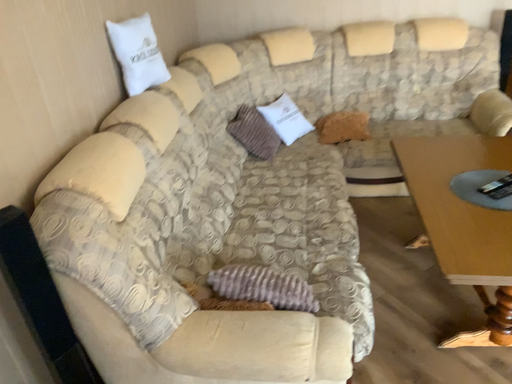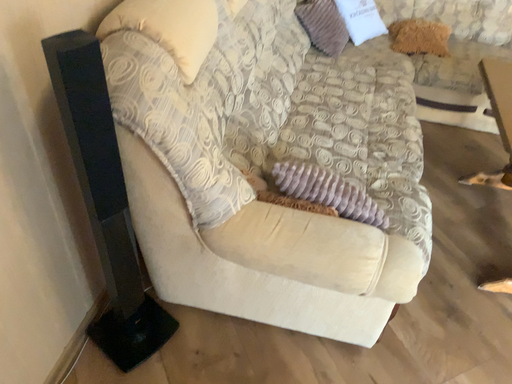
Question: How did the camera likely rotate when shooting the video?

Choices:
 (A) rotated upward
 (B) rotated downward

Answer: (B)